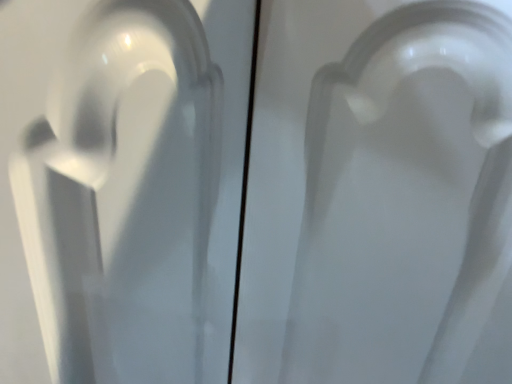
You are a GUI agent. You are given a task and a screenshot of the screen. Output one action in this format:
    pyautogui.click(x=<x>, y=<y>)
    Task: Click on the white glossy faucet at center
    
    Given the screenshot: What is the action you would take?
    pyautogui.click(x=405, y=199)

Looking at this image, what is the approximate width of white glossy faucet at center?

57.32 centimeters.

This screenshot has height=384, width=512. What do you see at coordinates (405, 199) in the screenshot? I see `white glossy faucet at center` at bounding box center [405, 199].

The width and height of the screenshot is (512, 384). Find the location of `white glossy faucet at center`. white glossy faucet at center is located at coordinates click(405, 199).